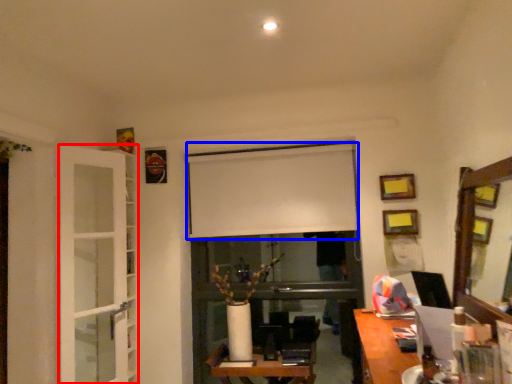
Question: Which object is further to the camera taking this photo, glass door (highlighted by a red box) or window screen (highlighted by a blue box)?

Choices:
 (A) glass door
 (B) window screen

Answer: (B)